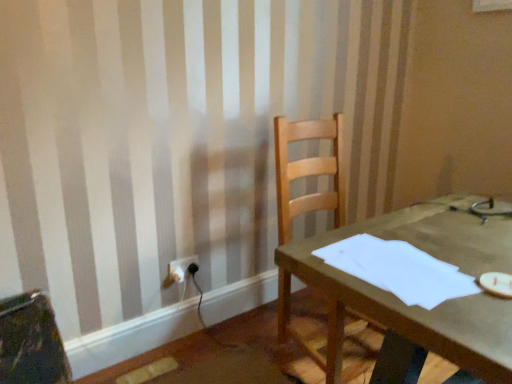
Question: Considering the relative sizes of white plastic electric outlet at lower left and white paper at center in the image provided, is white plastic electric outlet at lower left wider than white paper at center?

Choices:
 (A) yes
 (B) no

Answer: (B)

Question: Can you confirm if white plastic electric outlet at lower left is thinner than white paper at center?

Choices:
 (A) no
 (B) yes

Answer: (B)

Question: Would you consider white plastic electric outlet at lower left to be distant from white paper at center?

Choices:
 (A) no
 (B) yes

Answer: (B)

Question: Can you confirm if white plastic electric outlet at lower left is bigger than white paper at center?

Choices:
 (A) no
 (B) yes

Answer: (A)

Question: Is white plastic electric outlet at lower left not within white paper at center?

Choices:
 (A) no
 (B) yes

Answer: (B)

Question: From the image's perspective, does white plastic electric outlet at lower left appear higher than white paper at center?

Choices:
 (A) no
 (B) yes

Answer: (A)

Question: Is wooden chair at center at the left side of white plastic electric outlet at lower left?

Choices:
 (A) yes
 (B) no

Answer: (B)

Question: From the image's perspective, would you say wooden chair at center is positioned over white plastic electric outlet at lower left?

Choices:
 (A) yes
 (B) no

Answer: (A)

Question: Is wooden chair at center in front of white plastic electric outlet at lower left?

Choices:
 (A) no
 (B) yes

Answer: (B)

Question: Could you tell me if wooden chair at center is facing white plastic electric outlet at lower left?

Choices:
 (A) no
 (B) yes

Answer: (A)

Question: Does wooden chair at center have a lesser height compared to white plastic electric outlet at lower left?

Choices:
 (A) yes
 (B) no

Answer: (B)

Question: Is wooden chair at center placed right next to white plastic electric outlet at lower left?

Choices:
 (A) no
 (B) yes

Answer: (A)

Question: Does wooden chair at center have a lesser height compared to white paper at center?

Choices:
 (A) no
 (B) yes

Answer: (A)